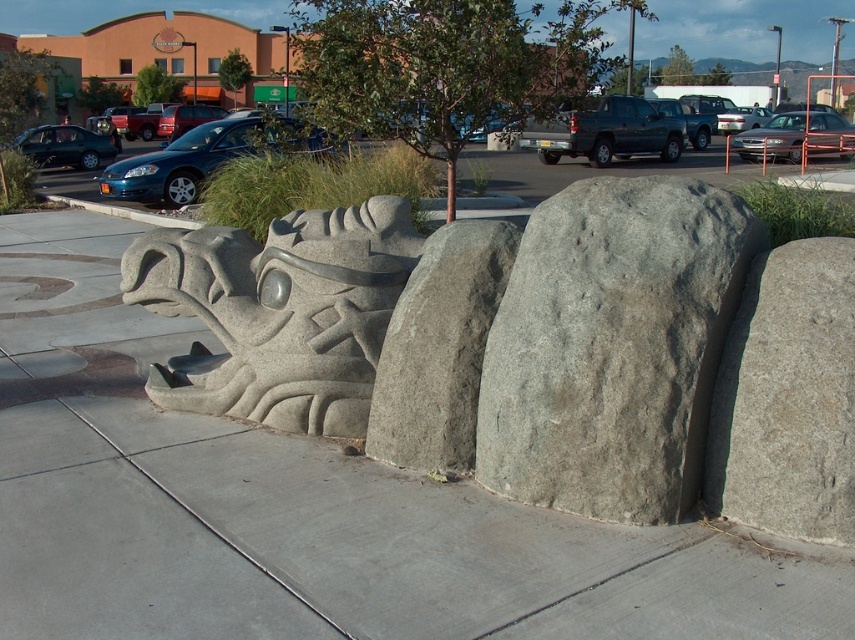
Between gray stone dragon at center and gray concrete curb at lower left, which one has less height?

gray concrete curb at lower left

Does point (361, 208) lie behind point (149, 216)?

That is False.

At what (x,y) coordinates should I click in order to perform the action: click on gray stone dragon at center. Please return your answer as a coordinate pair (x, y). Looking at the image, I should click on (278, 312).

Can you confirm if gray rough stone boulder at center is thinner than gray concrete curb at lower left?

Yes, gray rough stone boulder at center is thinner than gray concrete curb at lower left.

Is gray rough stone boulder at center wider than gray concrete curb at lower left?

No.

Which is in front, point (640, 250) or point (137, 214)?

Point (640, 250)

You are a GUI agent. You are given a task and a screenshot of the screen. Output one action in this format:
    pyautogui.click(x=<x>, y=<y>)
    Task: Click on the gray rough stone boulder at center
    The width and height of the screenshot is (855, 640).
    Given the screenshot: What is the action you would take?
    pyautogui.click(x=612, y=346)

Who is more distant from viewer, [37,188] or [144,214]?

Point [37,188]

Does gray stone parking lot at upper center lie in front of gray concrete curb at lower left?

Yes, it is.

At what (x,y) coordinates should I click in order to perform the action: click on gray stone parking lot at upper center. Please return your answer as a coordinate pair (x, y). Looking at the image, I should click on (594, 170).